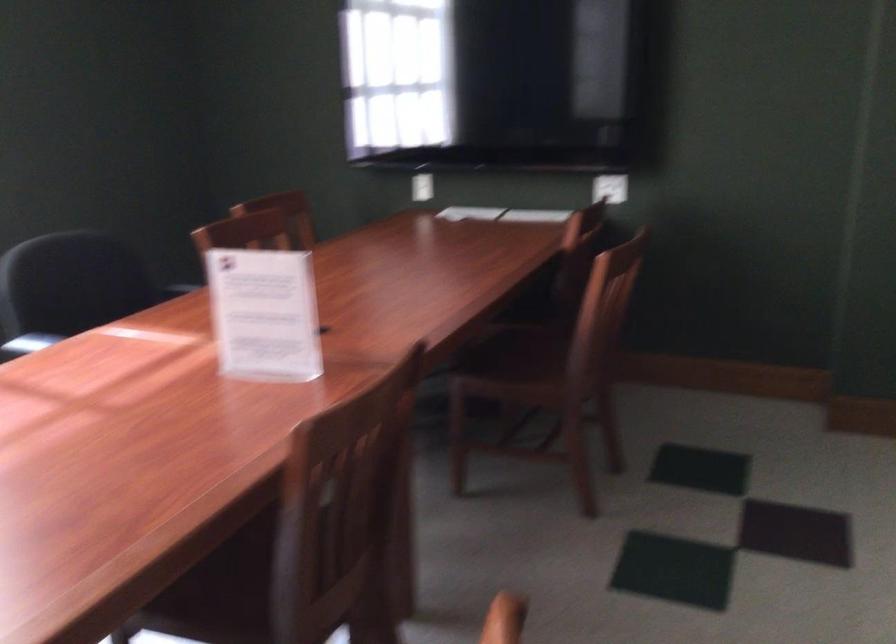
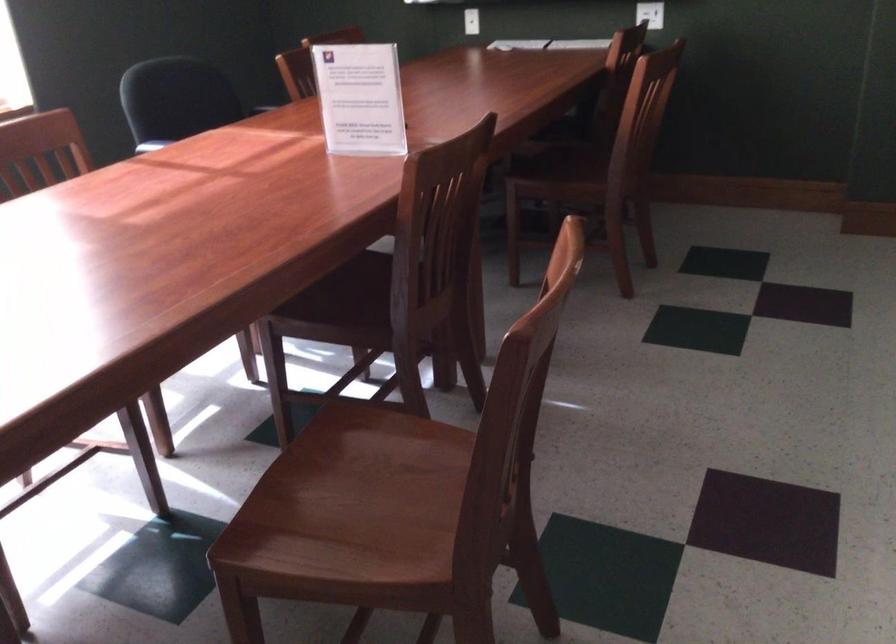
The point at (x=222, y=574) is marked in the first image. Where is the corresponding point in the second image?

(340, 301)